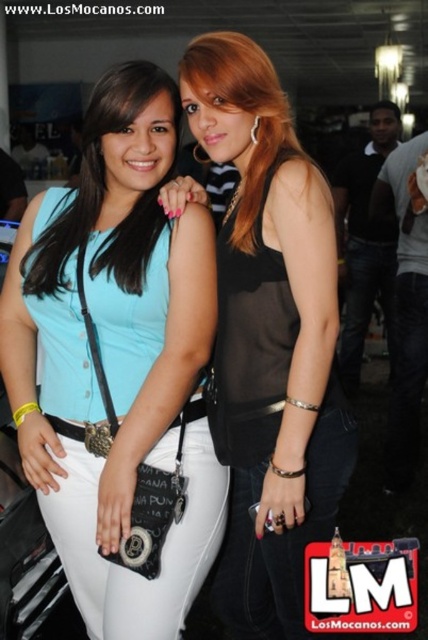
You are a photographer trying to capture a clear shot of both the matte black top at center and the black sheer top at center. Which one is closer to the camera?

The matte black top at center is closer to the camera because the black sheer top at center is positioned behind it.

You are taking a photo of two friends standing side by side. You want to focus on the point closer to the camera between the two points labeled as point (172, 628) and point (333, 476). Which point should you choose?

Point (172, 628) is closer to the camera than point (333, 476), so you should choose point (172, 628) to focus on.

You are standing at the point marked as point [148,128] in the image. You want to take a photo of the two people in the scene. Can you fit both people into your camera frame without moving? Explain your reasoning based on their positions relative to you.

The point marked as point [148,128] is 5.77 feet away from you. Since both people are positioned in the same general area and within a close proximity to each other, it is likely that they can both fit into your camera frame without needing to move. However, the exact composition would depend on the camera lens and zoom settings available.